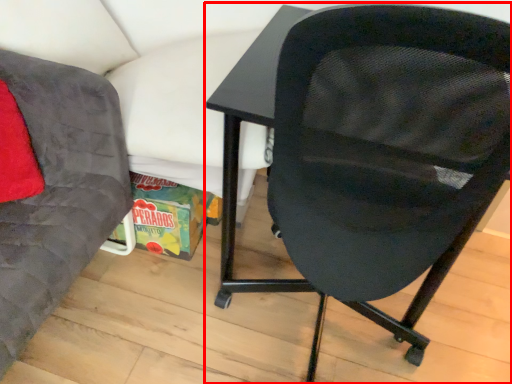
Question: From the image's perspective, where is chair (annotated by the red box) located relative to chair?

Choices:
 (A) below
 (B) above

Answer: (B)